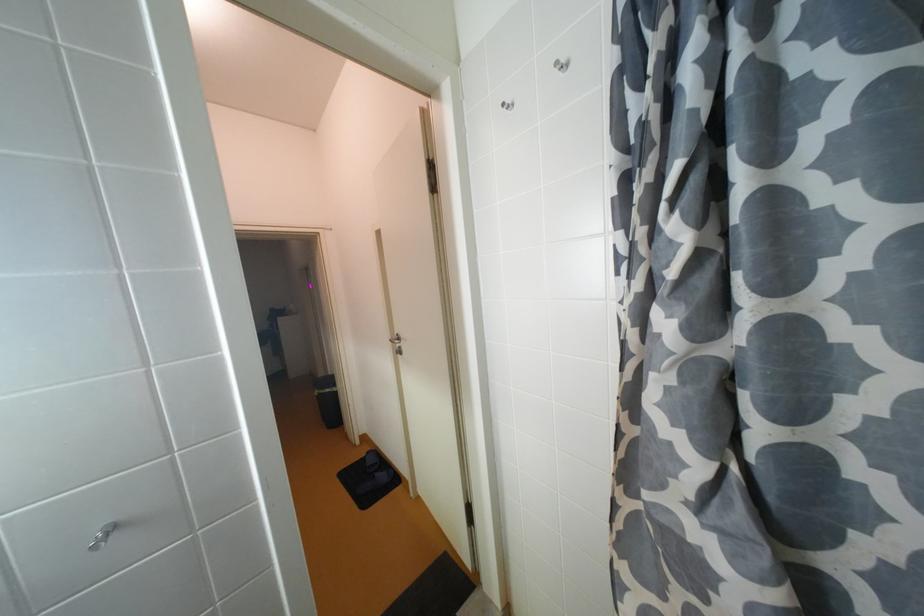
In order to click on silver door hook in this screenshot , I will do `click(339, 313)`.